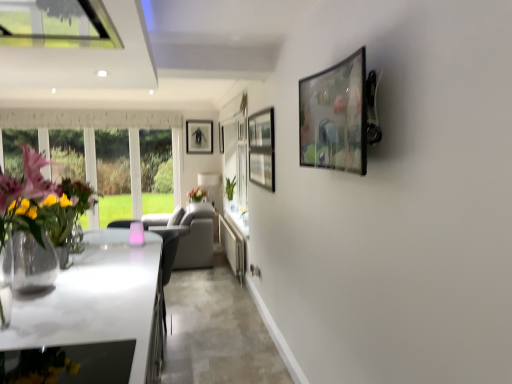
Question: From a real-world perspective, is matte black picture frame at center, placed as the 3th picture frame when sorted from right to left, located higher than white glossy counter top at center?

Choices:
 (A) no
 (B) yes

Answer: (B)

Question: Does matte black picture frame at center, placed as the 3th picture frame when sorted from right to left, turn towards white glossy counter top at center?

Choices:
 (A) yes
 (B) no

Answer: (B)

Question: From the image's perspective, is matte black picture frame at center, placed as the 3th picture frame when sorted from right to left, above white glossy counter top at center?

Choices:
 (A) yes
 (B) no

Answer: (A)

Question: Are matte black picture frame at center, placed as the 3th picture frame when sorted from right to left, and white glossy counter top at center beside each other?

Choices:
 (A) no
 (B) yes

Answer: (A)

Question: Is matte black picture frame at center, the first picture frame from the left, turned away from white glossy counter top at center?

Choices:
 (A) no
 (B) yes

Answer: (A)

Question: Is point (217, 177) positioned closer to the camera than point (70, 336)?

Choices:
 (A) closer
 (B) farther

Answer: (B)

Question: In terms of size, does white fabric lampshade at center appear bigger or smaller than white glossy countertop at lower left?

Choices:
 (A) small
 (B) big

Answer: (A)

Question: In the image, is white fabric lampshade at center positioned in front of or behind white glossy countertop at lower left?

Choices:
 (A) behind
 (B) front

Answer: (A)

Question: In terms of width, does white fabric lampshade at center look wider or thinner when compared to white glossy countertop at lower left?

Choices:
 (A) wide
 (B) thin

Answer: (B)

Question: Choose the correct answer: Is white glossy counter top at center inside matte black picture frame at center, the first picture frame from the left, or outside it?

Choices:
 (A) outside
 (B) inside

Answer: (A)

Question: Is white glossy counter top at center to the left or to the right of matte black picture frame at center, which appears as the third picture frame when viewed from the front, in the image?

Choices:
 (A) right
 (B) left

Answer: (A)

Question: Is white glossy counter top at center taller or shorter than matte black picture frame at center, placed as the 3th picture frame when sorted from right to left?

Choices:
 (A) short
 (B) tall

Answer: (A)

Question: From the image's perspective, is white glossy counter top at center positioned above or below matte black picture frame at center, which is the first picture frame in back-to-front order?

Choices:
 (A) above
 (B) below

Answer: (B)

Question: From a real-world perspective, is translucent glass vase at center physically located above or below matte black picture frame at center, the first picture frame from the left?

Choices:
 (A) below
 (B) above

Answer: (A)

Question: In the image, is translucent glass vase at center positioned in front of or behind matte black picture frame at center, the first picture frame from the left?

Choices:
 (A) front
 (B) behind

Answer: (A)